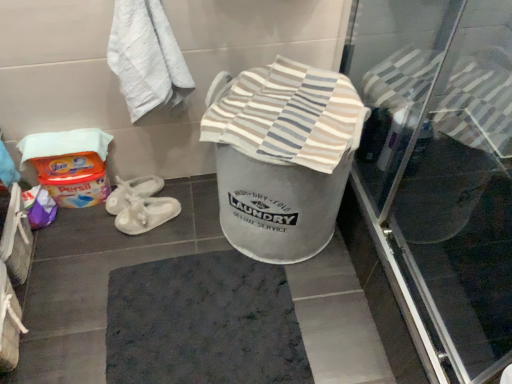
Question: Would you consider dark gray textured bath mat at center to be distant from white textured towel at upper left?

Choices:
 (A) yes
 (B) no

Answer: (B)

Question: Could you tell me if dark gray textured bath mat at center is facing white textured towel at upper left?

Choices:
 (A) no
 (B) yes

Answer: (A)

Question: From a real-world perspective, is dark gray textured bath mat at center on top of white textured towel at upper left?

Choices:
 (A) yes
 (B) no

Answer: (B)

Question: From the image's perspective, does dark gray textured bath mat at center appear lower than white textured towel at upper left?

Choices:
 (A) no
 (B) yes

Answer: (B)

Question: Considering the relative positions of dark gray textured bath mat at center and white textured towel at upper left in the image provided, is dark gray textured bath mat at center behind white textured towel at upper left?

Choices:
 (A) no
 (B) yes

Answer: (B)

Question: Is dark gray textured bath mat at center smaller than white textured towel at upper left?

Choices:
 (A) yes
 (B) no

Answer: (A)

Question: Is striped cotton towel at center located outside dark gray textured bath mat at center?

Choices:
 (A) yes
 (B) no

Answer: (A)

Question: Could you tell me if striped cotton towel at center is facing dark gray textured bath mat at center?

Choices:
 (A) no
 (B) yes

Answer: (A)

Question: Is striped cotton towel at center turned away from dark gray textured bath mat at center?

Choices:
 (A) yes
 (B) no

Answer: (B)

Question: Is striped cotton towel at center further to camera compared to dark gray textured bath mat at center?

Choices:
 (A) no
 (B) yes

Answer: (A)

Question: Is striped cotton towel at center next to dark gray textured bath mat at center?

Choices:
 (A) yes
 (B) no

Answer: (B)

Question: Does striped cotton towel at center have a lesser width compared to dark gray textured bath mat at center?

Choices:
 (A) yes
 (B) no

Answer: (A)

Question: Can you confirm if transparent glass screen door at upper right is positioned to the left of dark gray textured bath mat at center?

Choices:
 (A) yes
 (B) no

Answer: (B)